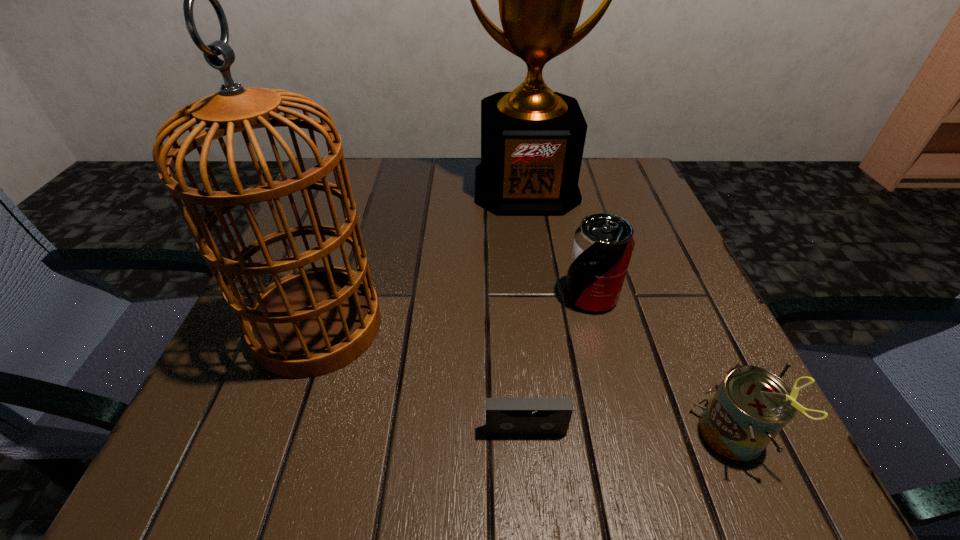
In the image, there is a desktop. In order to click on blank space at the near edge in this screenshot , I will do `click(478, 480)`.

Locate an element on the screen. This screenshot has height=540, width=960. vacant area at the left edge is located at coordinates (264, 414).

Where is `blank area at the right edge`? Image resolution: width=960 pixels, height=540 pixels. blank area at the right edge is located at coordinates (643, 217).

You are a GUI agent. You are given a task and a screenshot of the screen. Output one action in this format:
    pyautogui.click(x=<x>, y=<y>)
    Task: Click on the free space at the far left corner of the desktop
    This screenshot has width=960, height=540.
    Given the screenshot: What is the action you would take?
    pyautogui.click(x=359, y=165)

Where is `vacant space at the near left corner of the desktop`? vacant space at the near left corner of the desktop is located at coordinates (235, 439).

Image resolution: width=960 pixels, height=540 pixels. Identify the location of vacant area at the far right corner. (615, 205).

The height and width of the screenshot is (540, 960). Find the location of `free region at the near right corner`. free region at the near right corner is located at coordinates (797, 480).

Locate an element on the screen. This screenshot has width=960, height=540. empty space between the videotape and the leftmost object is located at coordinates (421, 378).

Identify the location of vacant space in between the trophy cup and the can. (630, 311).

Where is `unoccupied position between the soda can and the can`? This screenshot has width=960, height=540. unoccupied position between the soda can and the can is located at coordinates (662, 365).